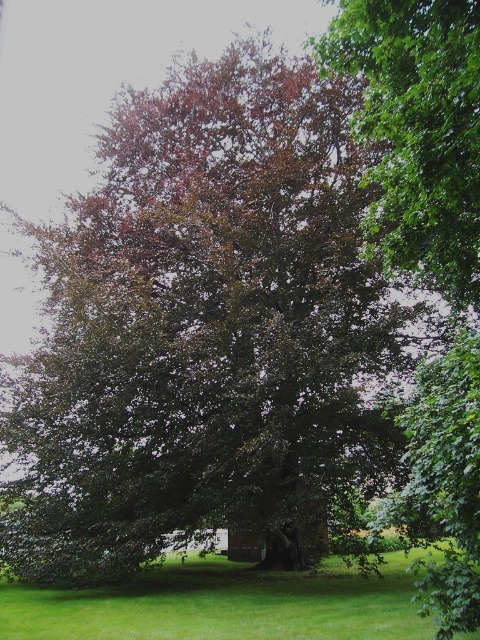
You are a gardener planning to mow the lawn. You see the green leafy tree at upper right and the green grass at lower center. Which area should you avoid mowing to prevent damaging the tree?

You should avoid mowing near the green leafy tree at upper right because it is smaller than the green grass at lower center, making it more vulnerable to damage from mowing equipment.

You are a gardener planning to plant a new flower bed between the green leafy tree at upper right and the green grass at lower center. The flower bed requires a minimum distance of 5 meters between the tree and the grass to ensure proper growth. Based on the scene, will the existing spacing allow for this?

The green leafy tree at upper right is 6.79 meters from the green grass at lower center, which exceeds the required 5 meters. Therefore, the existing spacing allows for planting the flower bed.

You are a gardener planning to plant a new tree in the area. Based on the image, which object between the green leafy tree at upper right and the green grass at lower center has a smaller width?

The green leafy tree at upper right is thinner than the green grass at lower center, so the green leafy tree at upper right has a smaller width.